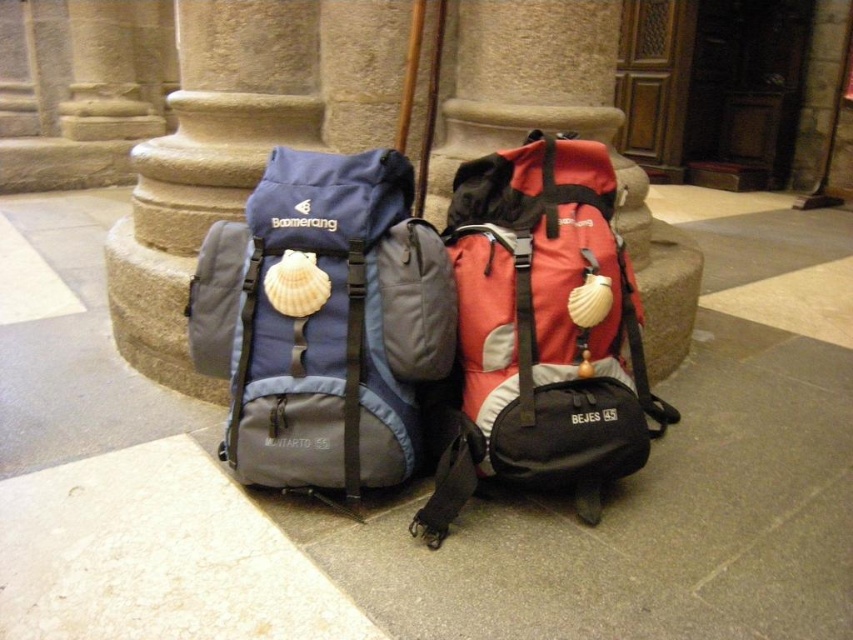
You are standing in front of the two backpacks in the cathedral. There are two points marked on the floor. One is at coordinate point (x=704, y=452) and the other at point (x=548, y=314). If you want to walk from the point closer to you to the one further away, which point should you start at?

You should start at point (x=548, y=314) because point (x=704, y=452) is behind point (x=548, y=314), meaning it is further away from you. So the closer point is (x=548, y=314) and the further is (x=704, y=452).

You are standing on the gray stone pavement at center. You want to move to the backpack on the left. Which direction should you go?

The gray stone pavement at center is located at point (421, 492), so you should move to the left to reach the backpack on the left.